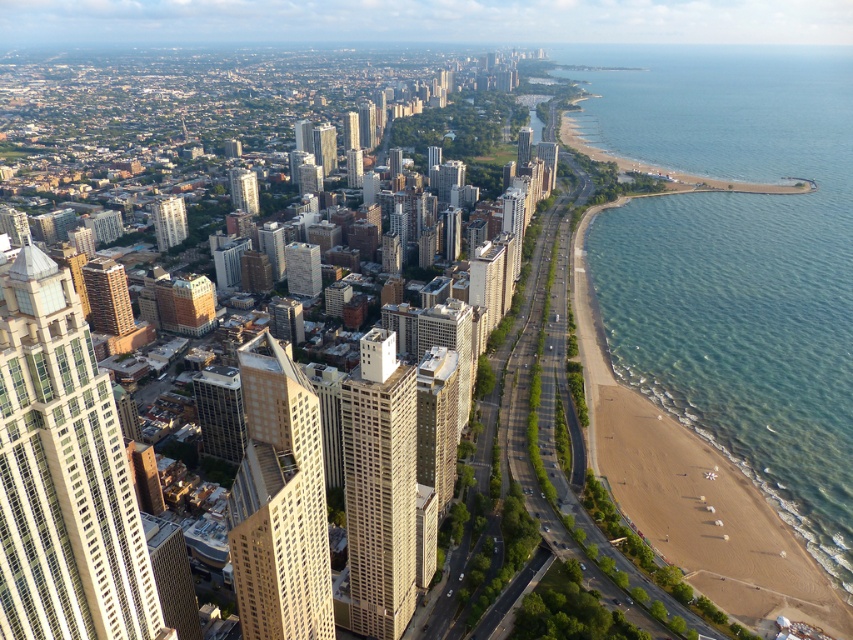
Is point (80, 477) in front of point (112, 330)?

Yes, it is.

Where is `beige glass skyscraper at center-left`? Image resolution: width=853 pixels, height=640 pixels. beige glass skyscraper at center-left is located at coordinates (62, 474).

Is brown brick building at center-left to the left of beige concrete building at center-left from the viewer's perspective?

Yes, brown brick building at center-left is to the left of beige concrete building at center-left.

Which is more to the right, brown brick building at center-left or beige concrete building at center-left?

From the viewer's perspective, beige concrete building at center-left appears more on the right side.

At what (x,y) coordinates should I click in order to perform the action: click on brown brick building at center-left. Please return your answer as a coordinate pair (x, y). This screenshot has height=640, width=853. Looking at the image, I should click on pos(107,296).

At what (x,y) coordinates should I click in order to perform the action: click on brown brick building at center-left. Please return your answer as a coordinate pair (x, y). This screenshot has width=853, height=640. Looking at the image, I should click on (107, 296).

Is point (682, 234) more distant than point (410, 525)?

Yes, it is.

Is clear blue water at right below beige concrete building at center?

No, clear blue water at right is not below beige concrete building at center.

Who is more distant from viewer, (836, 426) or (378, 586)?

The point (836, 426) is behind.

At what (x,y) coordinates should I click in order to perform the action: click on clear blue water at right. Please return your answer as a coordinate pair (x, y). Image resolution: width=853 pixels, height=640 pixels. Looking at the image, I should click on (735, 262).